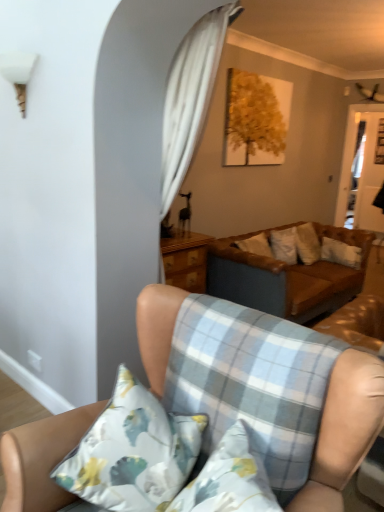
Question: Is floral fabric pillow at lower left not near light blue plaid cushion at lower center?

Choices:
 (A) no
 (B) yes

Answer: (A)

Question: From a real-world perspective, is floral fabric pillow at lower left over light blue plaid cushion at lower center?

Choices:
 (A) no
 (B) yes

Answer: (A)

Question: Is floral fabric pillow at lower left not inside light blue plaid cushion at lower center?

Choices:
 (A) no
 (B) yes

Answer: (B)

Question: Can you confirm if floral fabric pillow at lower left is taller than light blue plaid cushion at lower center?

Choices:
 (A) yes
 (B) no

Answer: (A)

Question: Is floral fabric pillow at lower left further to camera compared to light blue plaid cushion at lower center?

Choices:
 (A) no
 (B) yes

Answer: (B)

Question: Is brown leather couch at center, which is the 2th studio couch in front-to-back order, spatially inside light blue plaid cushion at lower center, or outside of it?

Choices:
 (A) inside
 (B) outside

Answer: (B)

Question: From the image's perspective, is brown leather couch at center, which is the 2th studio couch in front-to-back order, located above or below light blue plaid cushion at lower center?

Choices:
 (A) below
 (B) above

Answer: (B)

Question: Looking at their shapes, would you say brown leather couch at center, which is the 2th studio couch in front-to-back order, is wider or thinner than light blue plaid cushion at lower center?

Choices:
 (A) wide
 (B) thin

Answer: (A)

Question: Considering the relative positions of brown leather couch at center, the first studio couch positioned from the back, and light blue plaid cushion at lower center in the image provided, is brown leather couch at center, the first studio couch positioned from the back, to the left or to the right of light blue plaid cushion at lower center?

Choices:
 (A) right
 (B) left

Answer: (A)

Question: Looking at their shapes, would you say light brown leather couch at center, the second studio couch viewed from the back, is wider or thinner than transparent glass door at right?

Choices:
 (A) thin
 (B) wide

Answer: (B)

Question: Is point (31, 432) positioned closer to the camera than point (369, 175)?

Choices:
 (A) closer
 (B) farther

Answer: (A)

Question: From a real-world perspective, is light brown leather couch at center, which is the 1th studio couch in front-to-back order, above or below transparent glass door at right?

Choices:
 (A) above
 (B) below

Answer: (B)

Question: From the image's perspective, is light brown leather couch at center, the second studio couch viewed from the back, located above or below transparent glass door at right?

Choices:
 (A) below
 (B) above

Answer: (A)

Question: From the image's perspective, relative to light brown leather couch at center, which is the 1th studio couch in front-to-back order, is white sheer curtain at upper center above or below?

Choices:
 (A) below
 (B) above

Answer: (B)

Question: From a real-world perspective, relative to light brown leather couch at center, the second studio couch viewed from the back, is white sheer curtain at upper center vertically above or below?

Choices:
 (A) above
 (B) below

Answer: (A)